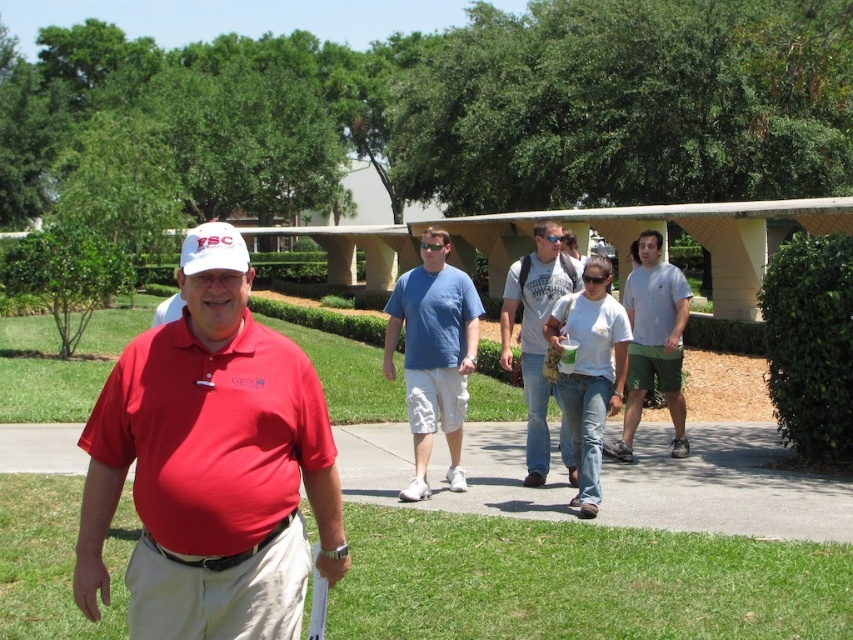
You are standing at the point marked as point [550,262]. The golf course is 7.86 meters away from you. Can you walk directly to the golf course from your current position?

Yes, you can walk directly to the golf course from point [550,262] since it is only 7.86 meters away.